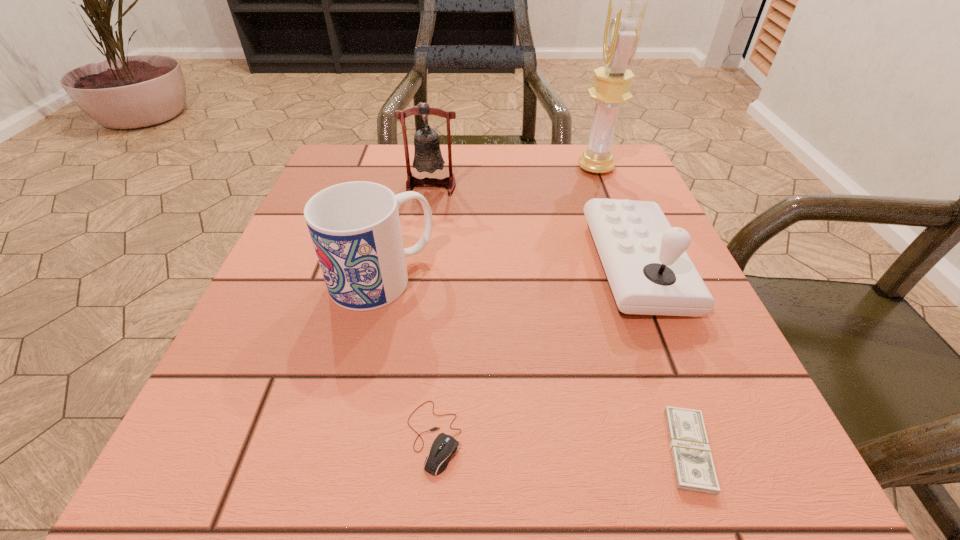
This screenshot has width=960, height=540. I want to click on award, so click(625, 17).

The height and width of the screenshot is (540, 960). Find the location of `the second tallest object`. the second tallest object is located at coordinates (427, 156).

The height and width of the screenshot is (540, 960). Identify the location of mug. (355, 228).

The image size is (960, 540). In order to click on joystick in this screenshot , I will do `click(649, 272)`.

Image resolution: width=960 pixels, height=540 pixels. Find the location of `the second shortest object`. the second shortest object is located at coordinates (444, 446).

In order to click on the shortest object in this screenshot , I will do `click(694, 470)`.

At what (x,y) coordinates should I click in order to perform the action: click on free region located 0.240m on the front-facing side of the award. Please return your answer as a coordinate pair (x, y). Looking at the image, I should click on (474, 168).

Identify the location of vacant space located on the front-facing side of the award. The image size is (960, 540). (504, 168).

You are a GUI agent. You are given a task and a screenshot of the screen. Output one action in this format:
    pyautogui.click(x=<x>, y=<y>)
    Task: Click on the vacant space located on the front-facing side of the award
    This screenshot has width=960, height=540.
    Given the screenshot: What is the action you would take?
    pyautogui.click(x=474, y=168)

Find the location of `vacant space situated 0.100m on the back of the fifth shortest object`. vacant space situated 0.100m on the back of the fifth shortest object is located at coordinates (436, 155).